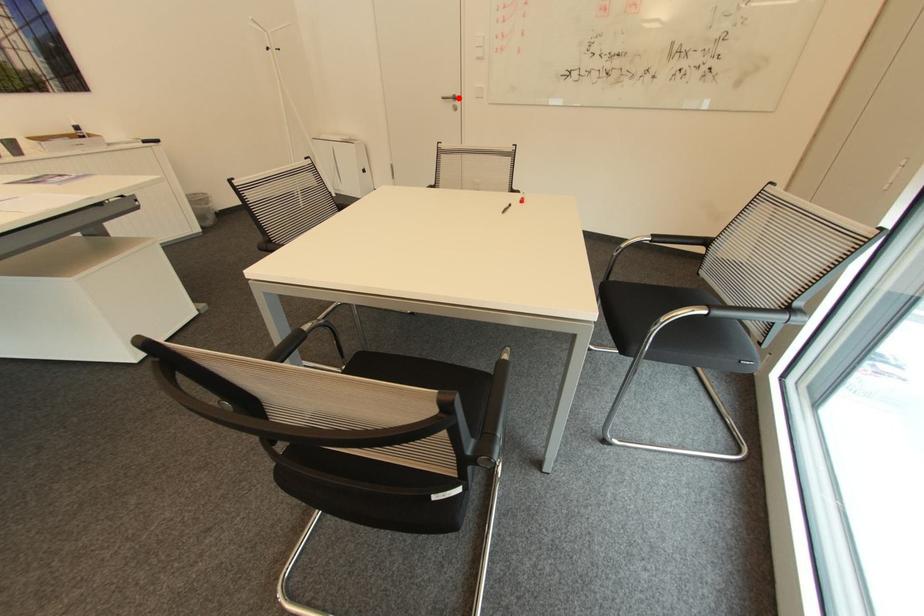
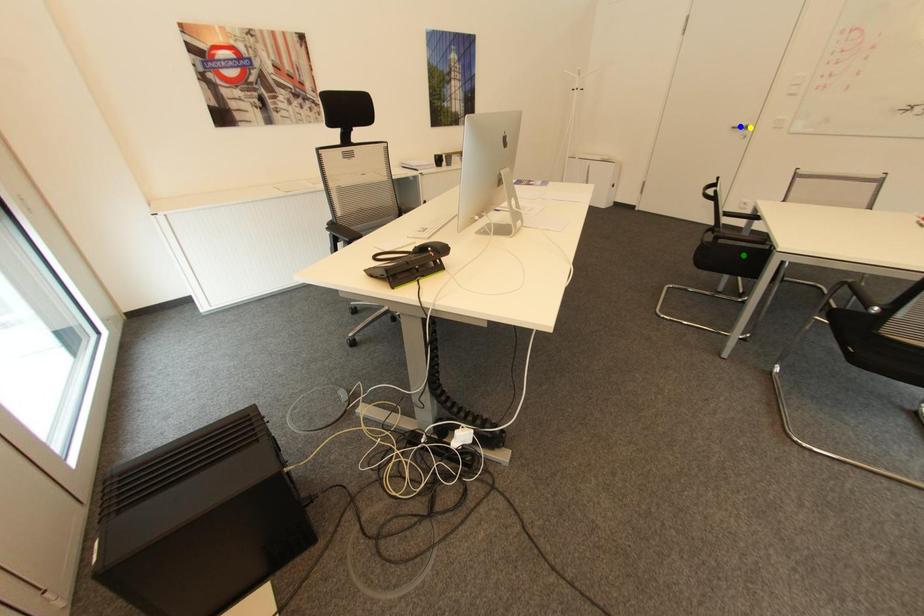
Question: I am providing you with two images of the same scene from different viewpoints. A red point is marked on the first image. You are given multiple points on the second image. Which point in image 2 represents the same 3d spot as the red point in image 1?

Choices:
 (A) yellow point
 (B) green point
 (C) blue point

Answer: (A)